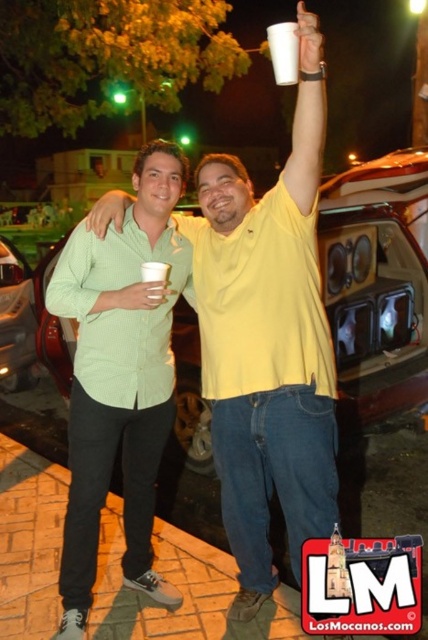
Which is more to the right, green matte shirt at center or metallic silver car at center?

Positioned to the right is metallic silver car at center.

Can you confirm if green matte shirt at center is smaller than metallic silver car at center?

Yes.

Is point (165, 300) positioned after point (401, 212)?

No, (165, 300) is in front of (401, 212).

The height and width of the screenshot is (640, 428). I want to click on green matte shirt at center, so click(119, 378).

Is metallic silver car at center thinner than metallic silver car at left?

In fact, metallic silver car at center might be wider than metallic silver car at left.

Who is positioned more to the left, metallic silver car at center or metallic silver car at left?

metallic silver car at left is more to the left.

The width and height of the screenshot is (428, 640). What do you see at coordinates (377, 284) in the screenshot? I see `metallic silver car at center` at bounding box center [377, 284].

Locate an element on the screen. This screenshot has width=428, height=640. metallic silver car at center is located at coordinates (377, 284).

Is metallic silver car at left smaller than white paper cup at upper center?

Correct, metallic silver car at left occupies less space than white paper cup at upper center.

Who is positioned more to the right, metallic silver car at left or white paper cup at upper center?

white paper cup at upper center

Identify the location of metallic silver car at left. (15, 321).